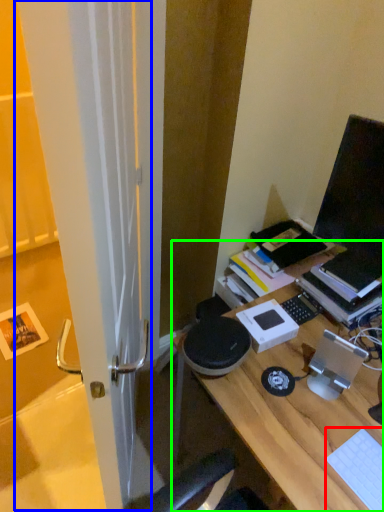
Question: Which object is positioned closest to laptop keyboard (highlighted by a red box)? Select from screen door (highlighted by a blue box) and desk (highlighted by a green box).

Choices:
 (A) screen door
 (B) desk

Answer: (B)